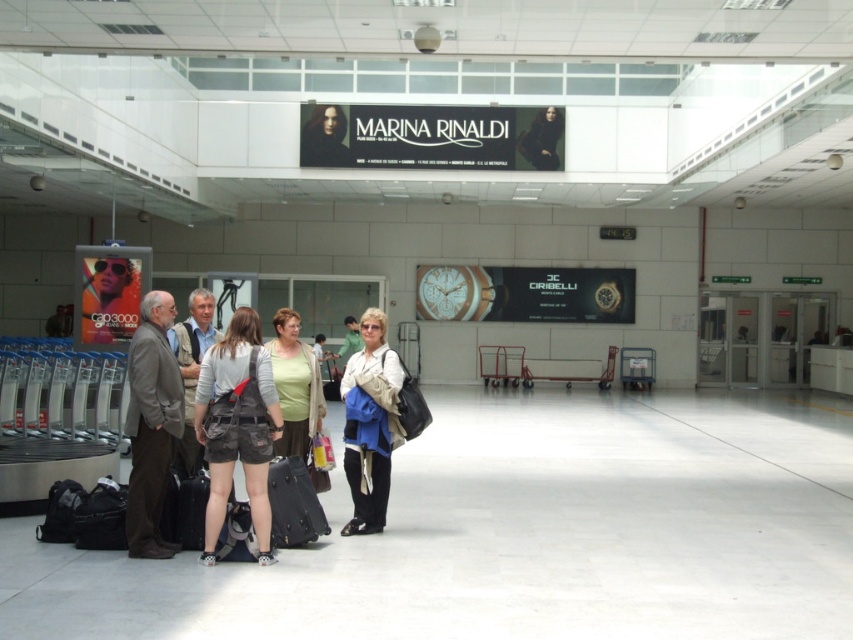
Question: Does brown leather jacket at left appear on the right side of light brown leather jacket at center?

Choices:
 (A) yes
 (B) no

Answer: (B)

Question: Which object appears closest to the camera in this image?

Choices:
 (A) light brown leather jacket at center
 (B) black leather jacket at upper center
 (C) smooth black hair at upper center
 (D) black textured suitcase at center

Answer: (D)

Question: Considering the real-world distances, which object is closest to the light green jersey at center?

Choices:
 (A) black leather jacket at upper center
 (B) light gray fabric jacket at center
 (C) white cotton shirt at center

Answer: (C)

Question: Where is black fabric suitcase at center located in relation to light brown leather jacket at center in the image?

Choices:
 (A) right
 (B) left

Answer: (A)

Question: Which point appears farthest from the camera in this image?

Choices:
 (A) (190, 365)
 (B) (215, 362)
 (C) (282, 497)

Answer: (A)

Question: Is brown leather jacket at left positioned behind smooth black hair at upper center?

Choices:
 (A) yes
 (B) no

Answer: (B)